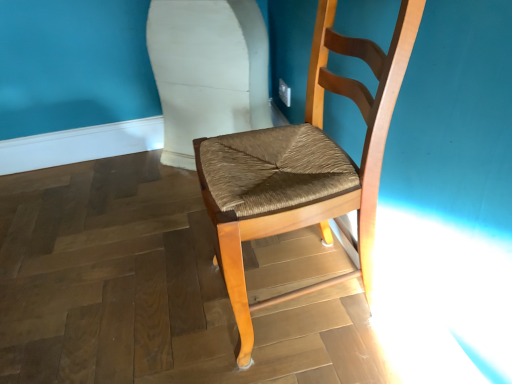
Where is `wooden chair with woven seat at center`? wooden chair with woven seat at center is located at coordinates (304, 165).

From the picture: Measure the distance between point (348,161) and camera.

Point (348,161) and camera are 3.38 feet apart from each other.

What do you see at coordinates (304, 165) in the screenshot? Image resolution: width=512 pixels, height=384 pixels. I see `wooden chair with woven seat at center` at bounding box center [304, 165].

I want to click on wooden chair with woven seat at center, so click(x=304, y=165).